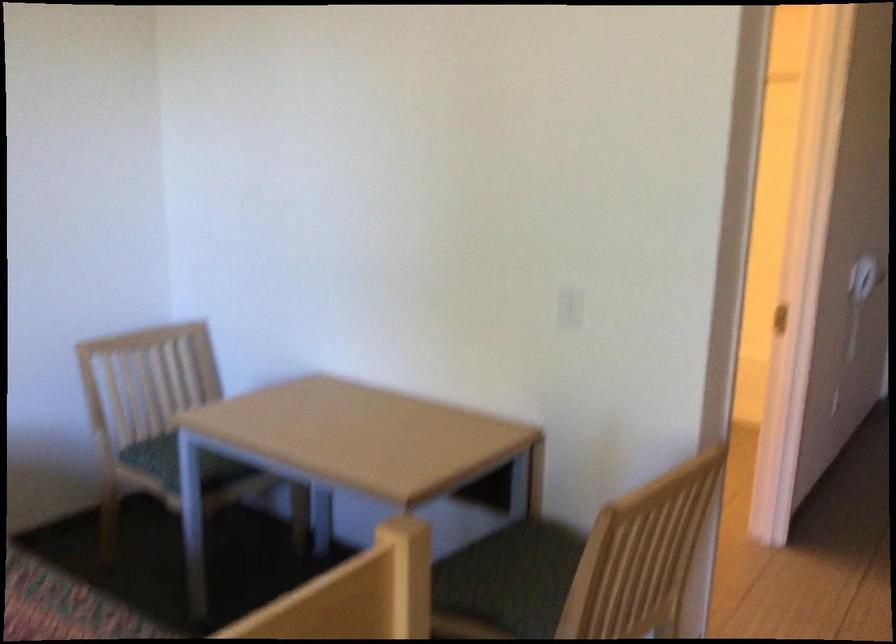
Find the location of `chair sitting surface`. chair sitting surface is located at coordinates (515, 565).